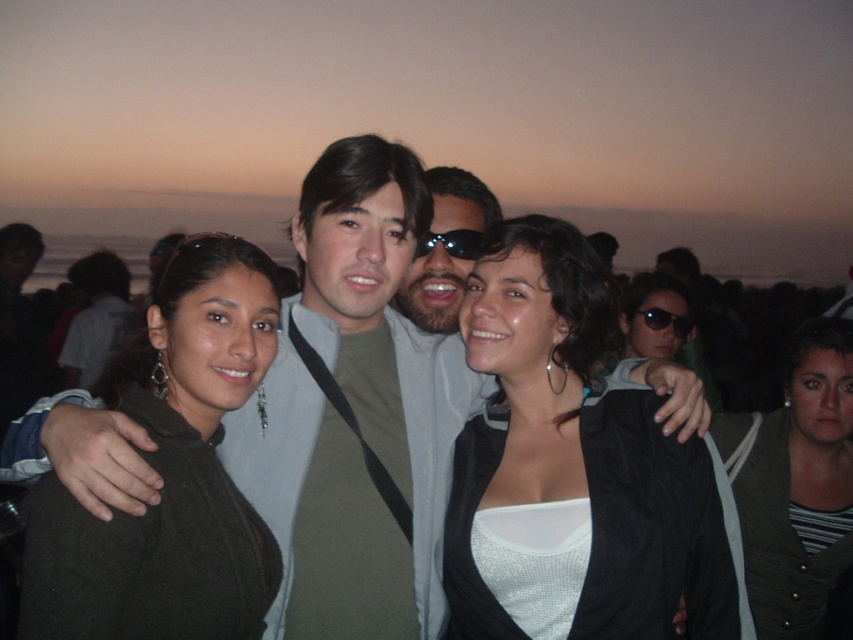
You are a GUI agent. You are given a task and a screenshot of the screen. Output one action in this format:
    pyautogui.click(x=<x>, y=<y>)
    Task: Click on the matte green sweater at center
    This screenshot has height=640, width=853.
    Given the screenshot: What is the action you would take?
    pyautogui.click(x=357, y=410)

Is matte green sweater at center positioned in front of striped fabric shirt at center?

Yes, matte green sweater at center is in front of striped fabric shirt at center.

Does point (383, 401) come behind point (834, 516)?

No, (383, 401) is in front of (834, 516).

Locate an element on the screen. The height and width of the screenshot is (640, 853). matte green sweater at center is located at coordinates pyautogui.click(x=357, y=410).

Does white matte jacket at center have a lesser width compared to matte green shirt at center?

No.

Find the location of a particular element. The image size is (853, 640). white matte jacket at center is located at coordinates (577, 454).

Between matte black goggles at center and black plastic sunglasses at center, which one is positioned higher?

matte black goggles at center

Between matte black goggles at center and black plastic sunglasses at center, which one appears on the right side from the viewer's perspective?

black plastic sunglasses at center

Does point (459, 246) come in front of point (680, 333)?

Yes.

Identify the location of matte black goggles at center. This screenshot has height=640, width=853. (451, 243).